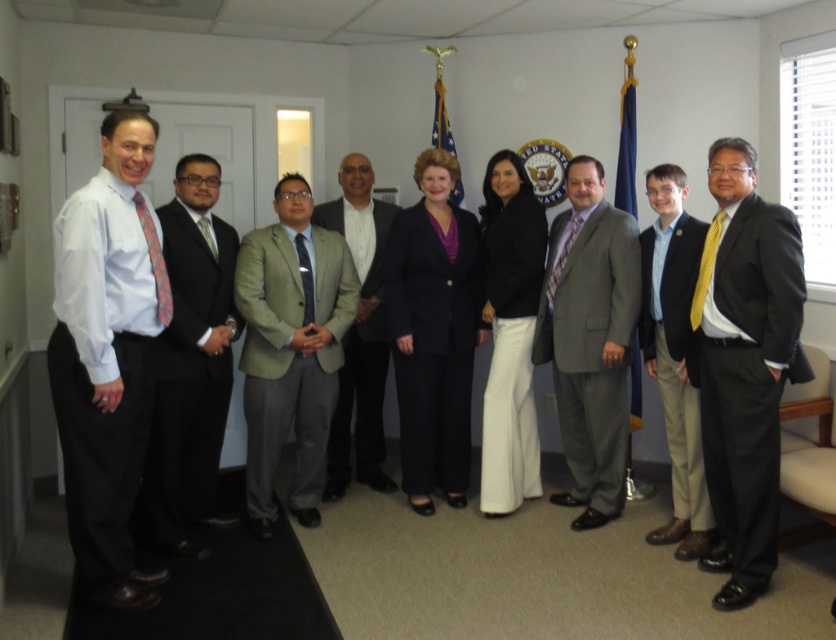
Measure the distance between point (462,356) and camera.

They are 12.60 feet apart.

Who is lower down, matte black suit at center or green silk tie at center?

matte black suit at center is below.

Is point (256, 520) positioned before point (213, 253)?

No, (256, 520) is further to viewer.

Locate an element on the screen. The width and height of the screenshot is (836, 640). matte black suit at center is located at coordinates (279, 314).

Can you confirm if patterned silk tie at left is positioned above green silk tie at center?

Actually, patterned silk tie at left is below green silk tie at center.

Is point (151, 253) closer to viewer compared to point (196, 225)?

Yes.

Is point (157, 307) positioned behind point (212, 228)?

That is False.

At what (x,y) coordinates should I click in order to perform the action: click on patterned silk tie at left. Please return your answer as a coordinate pair (x, y). The height and width of the screenshot is (640, 836). Looking at the image, I should click on (155, 260).

Is point (558, 276) closer to camera compared to point (298, 237)?

No.

Is patterned silk tie at center taller than dark gray silk tie at center?

No.

Who is more forward, (580, 225) or (297, 250)?

Point (297, 250)

I want to click on patterned silk tie at center, so click(562, 253).